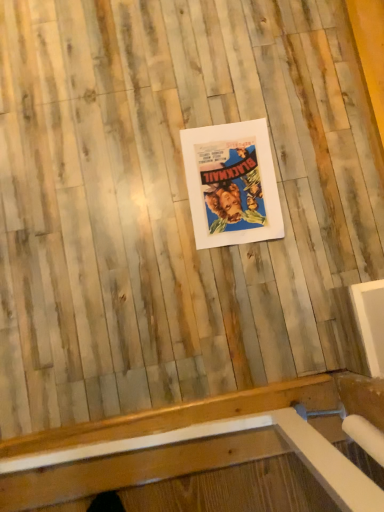
Identify the location of free space to the back side of white matte picture frame at center. This screenshot has height=512, width=384. (245, 93).